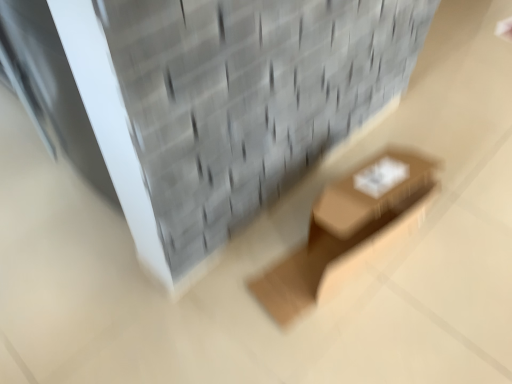
Question: From the image's perspective, is gray textured brickwork at upper center located above brown cardboard box at center?

Choices:
 (A) no
 (B) yes

Answer: (B)

Question: Does gray textured brickwork at upper center have a lesser width compared to brown cardboard box at center?

Choices:
 (A) yes
 (B) no

Answer: (B)

Question: Is brown cardboard box at center inside gray textured brickwork at upper center?

Choices:
 (A) yes
 (B) no

Answer: (B)

Question: Can you confirm if gray textured brickwork at upper center is wider than brown cardboard box at center?

Choices:
 (A) yes
 (B) no

Answer: (A)

Question: Is gray textured brickwork at upper center facing away from brown cardboard box at center?

Choices:
 (A) no
 (B) yes

Answer: (A)

Question: Is gray textured brickwork at upper center shorter than brown cardboard box at center?

Choices:
 (A) no
 (B) yes

Answer: (B)

Question: Does brown cardboard box at center touch gray textured brickwork at upper center?

Choices:
 (A) yes
 (B) no

Answer: (B)

Question: Does brown cardboard box at center have a smaller size compared to gray textured brickwork at upper center?

Choices:
 (A) no
 (B) yes

Answer: (B)

Question: Does brown cardboard box at center turn towards gray textured brickwork at upper center?

Choices:
 (A) no
 (B) yes

Answer: (A)

Question: Would you say brown cardboard box at center is outside gray textured brickwork at upper center?

Choices:
 (A) no
 (B) yes

Answer: (B)

Question: Is brown cardboard box at center far away from gray textured brickwork at upper center?

Choices:
 (A) yes
 (B) no

Answer: (B)

Question: From the image's perspective, is brown cardboard box at center over gray textured brickwork at upper center?

Choices:
 (A) no
 (B) yes

Answer: (A)

Question: Is gray textured brickwork at upper center bigger or smaller than brown cardboard box at center?

Choices:
 (A) big
 (B) small

Answer: (A)